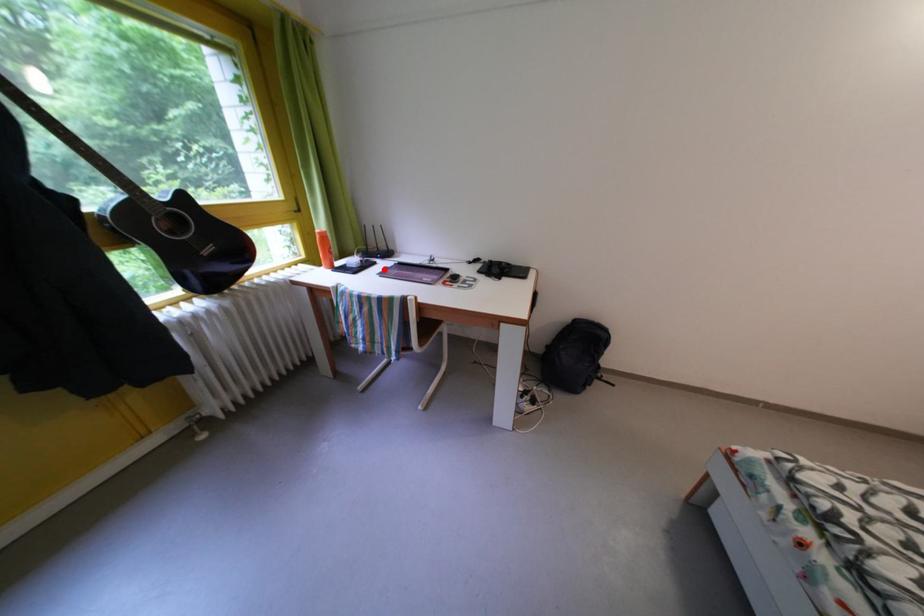
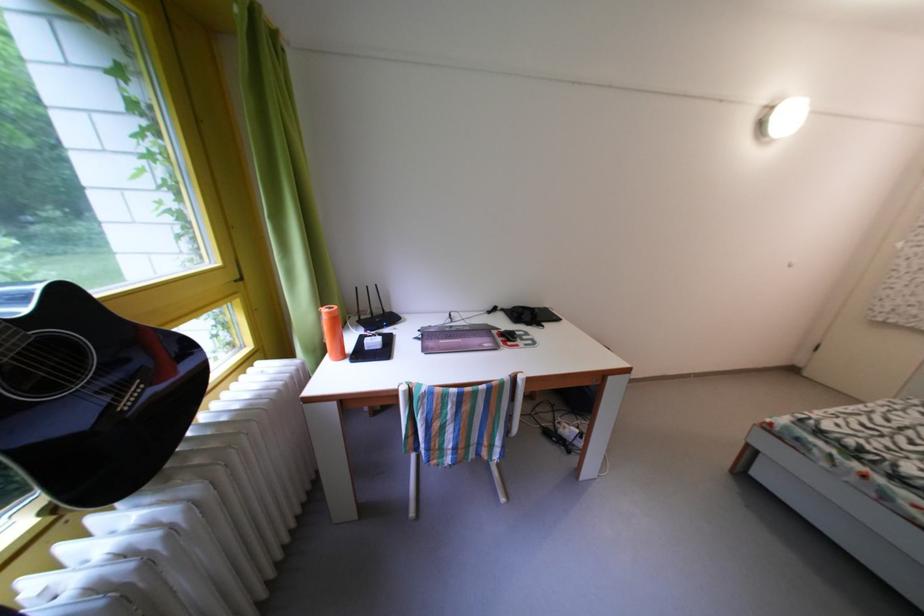
Question: I am providing you with two images of the same scene from different viewpoints. A red point is marked on the first image. At the location where the point appears in image 1, is it still visible in image 2?

Choices:
 (A) Yes
 (B) No

Answer: (B)